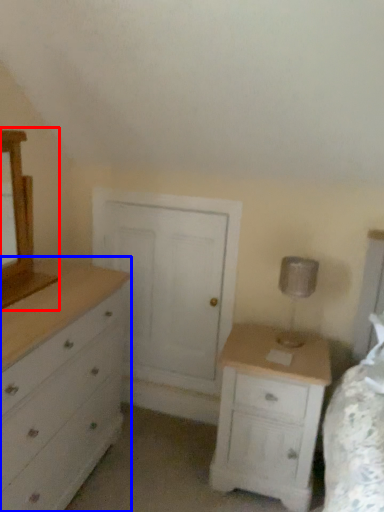
Question: Among these objects, which one is farthest to the camera, medicine cabinet (highlighted by a red box) or chest of drawers (highlighted by a blue box)?

Choices:
 (A) medicine cabinet
 (B) chest of drawers

Answer: (A)